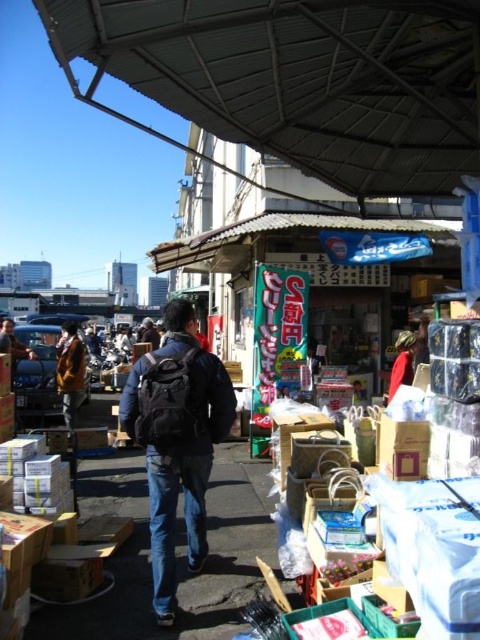
You are a customer at the market and need to pick up two items. You see a black backpack at center and a red fabric bag at center. Which item is positioned to the left when facing the market stalls?

The black backpack at center is to the left of the red fabric bag at center.

You are a customer at the market and want to locate the yellow fabric jacket at center. Which direction should you look relative to the metallic gray canopy at upper center?

The metallic gray canopy at upper center is to the right of the yellow fabric jacket at center, so you should look to the left of the metallic gray canopy at upper center to find the yellow fabric jacket at center.

What are the coordinates of the metallic gray canopy at upper center in the image?

The coordinates of the metallic gray canopy at upper center are at point (300, 77).